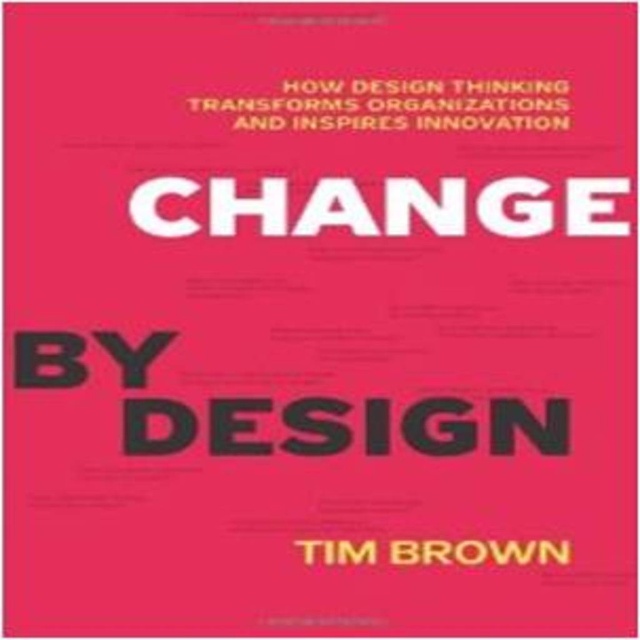
Is white matte text at center above yellow text at upper center?

Actually, white matte text at center is below yellow text at upper center.

Can you confirm if white matte text at center is positioned to the left of yellow text at upper center?

Yes, white matte text at center is to the left of yellow text at upper center.

Locate an element on the screen. The image size is (640, 640). white matte text at center is located at coordinates (339, 208).

Does yellow text at upper center have a greater height compared to whitetexttim brown at center?

Correct, yellow text at upper center is much taller as whitetexttim brown at center.

Who is positioned more to the left, yellow text at upper center or whitetexttim brown at center?

Positioned to the left is yellow text at upper center.

Is point (284, 109) farther from camera compared to point (352, 557)?

Yes, it is.

In order to click on yellow text at upper center in this screenshot , I will do `click(397, 106)`.

Does white matte text at center appear over whitetexttim brown at center?

Yes, white matte text at center is above whitetexttim brown at center.

Between white matte text at center and whitetexttim brown at center, which one is positioned higher?

Positioned higher is white matte text at center.

Who is more distant from viewer, (220, 212) or (476, 540)?

The point (220, 212) is more distant.

Locate an element on the screen. white matte text at center is located at coordinates (339, 208).